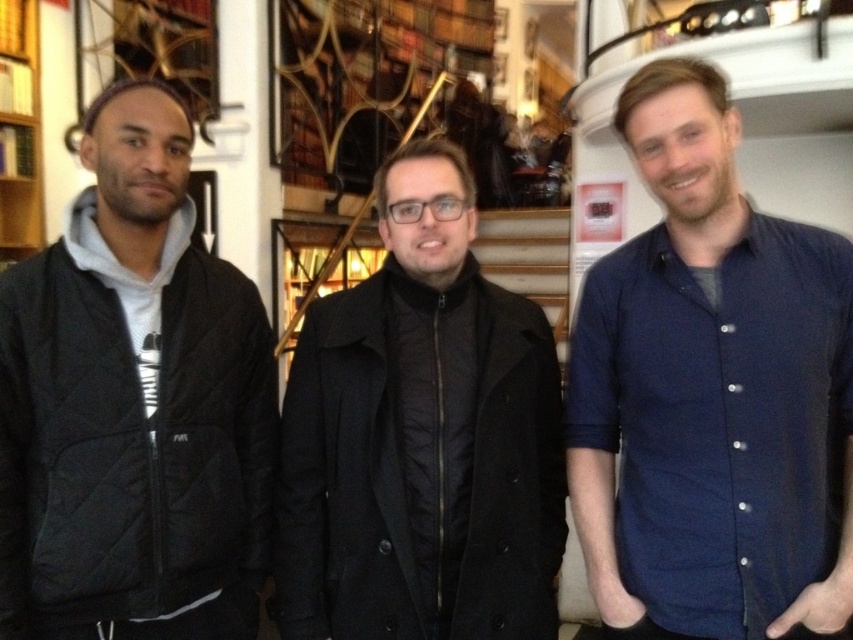
Does blue cotton shirt at right appear over wooden bookshelf at left?

No.

Between blue cotton shirt at right and wooden bookshelf at left, which one appears on the left side from the viewer's perspective?

wooden bookshelf at left

Find the location of a particular element. Image resolution: width=853 pixels, height=640 pixels. blue cotton shirt at right is located at coordinates (711, 394).

In order to click on blue cotton shirt at right in this screenshot , I will do `click(711, 394)`.

Which is in front, point (263, 406) or point (28, 150)?

Positioned in front is point (263, 406).

In order to click on black quilted jacket at left in this screenshot , I will do `click(132, 404)`.

Which is above, blue cotton shirt at right or black quilted jacket at left?

Positioned higher is blue cotton shirt at right.

Describe the element at coordinates (711, 394) in the screenshot. I see `blue cotton shirt at right` at that location.

This screenshot has width=853, height=640. Identify the location of blue cotton shirt at right. (711, 394).